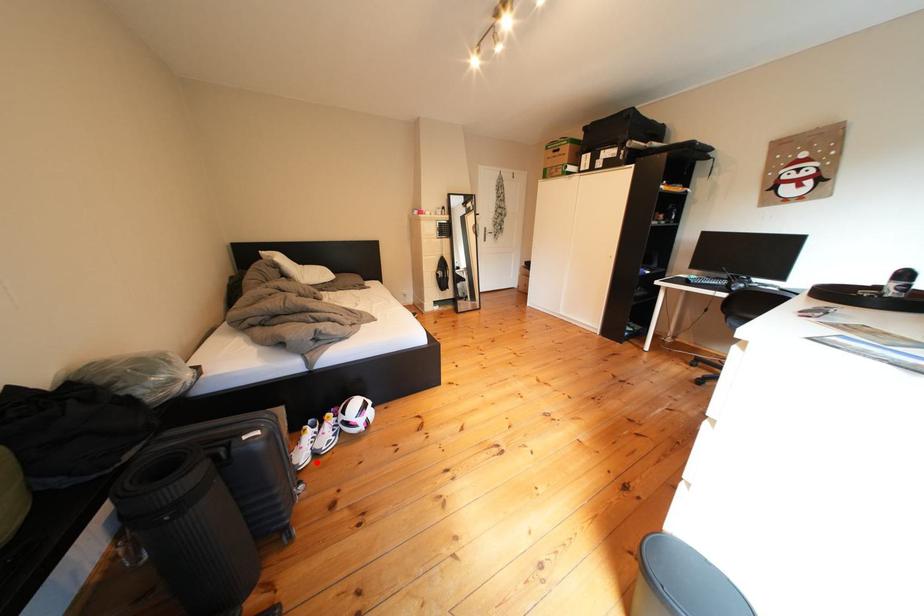
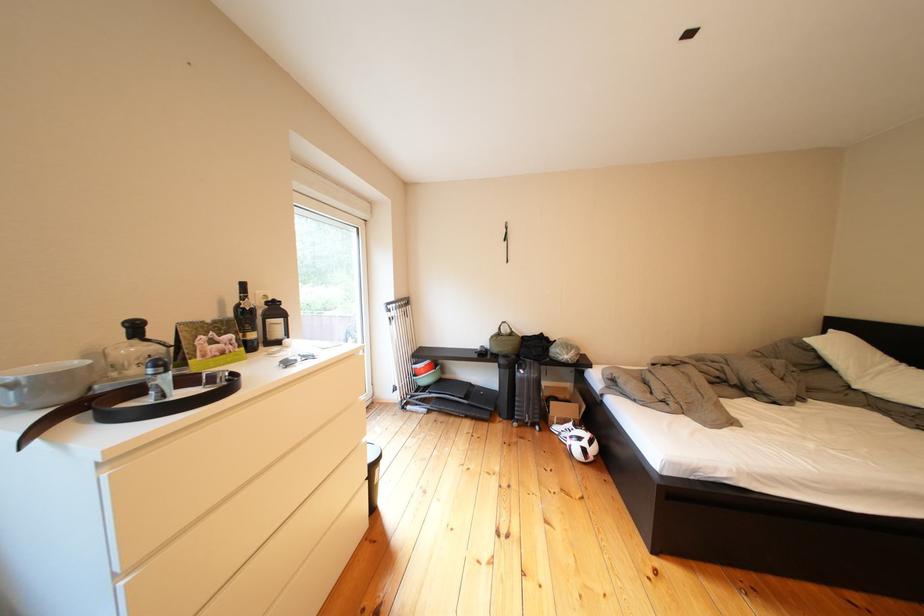
Question: A red point is marked in image1. In image2, is the corresponding 3D point closer to the camera or farther? Reply with the corresponding letter.

Choices:
 (A) The corresponding 3D point is closer.
 (B) The corresponding 3D point is farther.

Answer: (B)